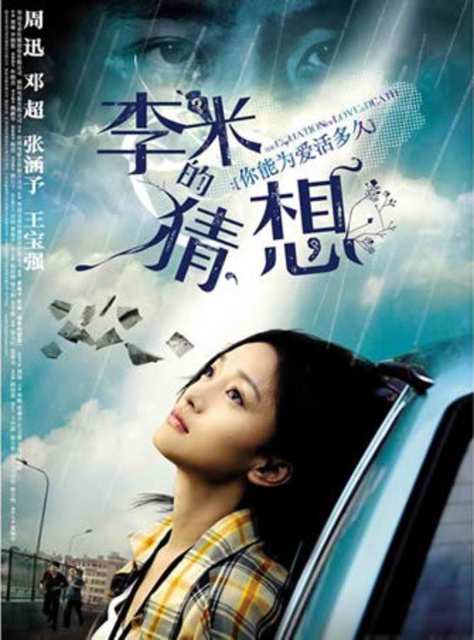
You are standing in front of the movie poster described. You want to touch the yellow plaid shirt at center with your hand. Can you reach it without moving your feet?

The yellow plaid shirt at center is 4.58 feet away from the viewer, which is farther than the typical human arm length of about 2 feet. Therefore, you cannot reach it without moving your feet.

Based on the scene described, can you determine if the yellow plaid shirt at center is positioned above or below the transparent glass car window at lower right?

The yellow plaid shirt at center is below the transparent glass car window at lower right according to the description.